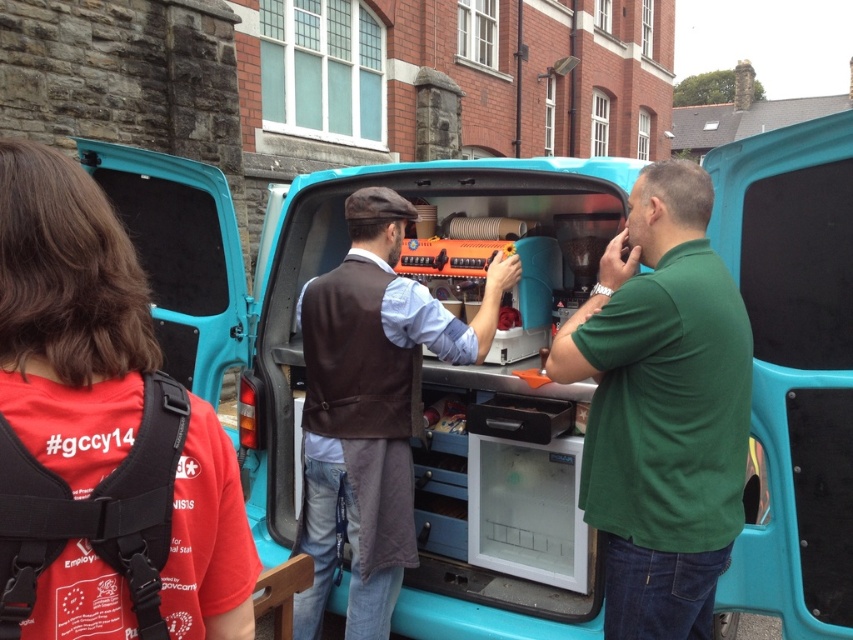
You are a customer looking at the two people near the turquoise van. The van has an open back with a coffee setup. Which person is wearing clothing that is positioned higher on their body between the green matte shirt at center and the brown leather vest at center?

The green matte shirt at center is positioned higher than the brown leather vest at center.

You are a photographer positioned to the side of the van. You want to capture a photo of both the green matte shirt at center and the brown leather vest at center without any overlap between them. Based on their positions, which direction should you move the camera to ensure both are fully visible?

The green matte shirt at center is to the right of the brown leather vest at center. To avoid overlap, move the camera to the left so both subjects can be framed without overlapping.